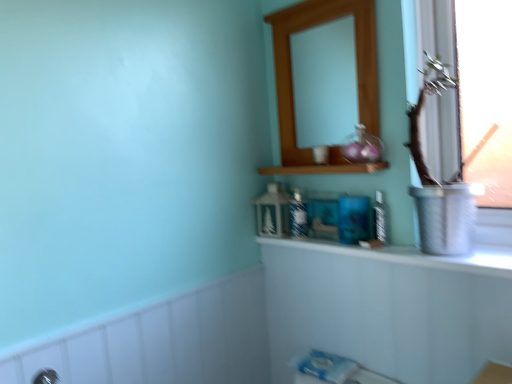
Where is `free spot below metallic silver vase at right (from a real-world perspective)`? This screenshot has height=384, width=512. free spot below metallic silver vase at right (from a real-world perspective) is located at coordinates point(454,248).